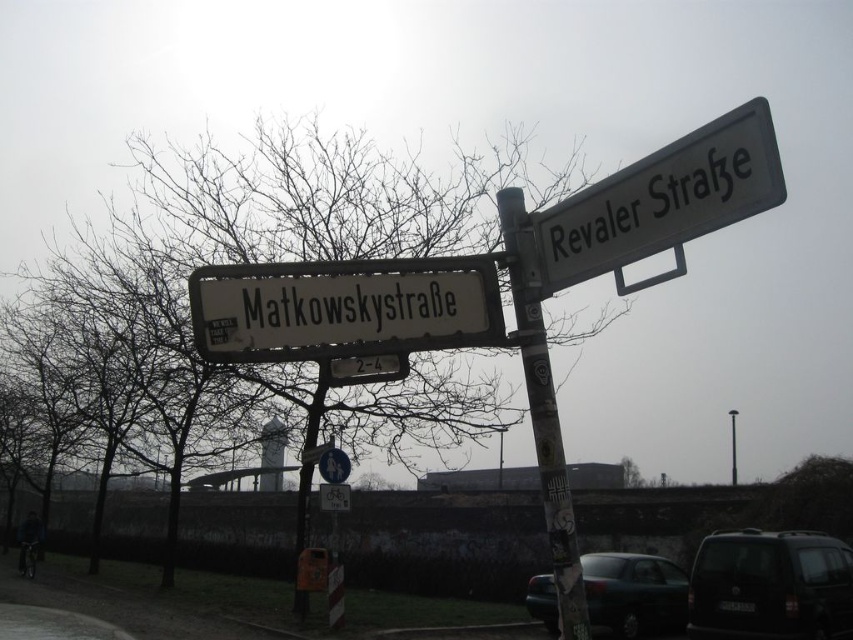
Question: Which object is farther from the camera taking this photo?

Choices:
 (A) white plastic street sign at upper right
 (B) stained wood pole at upper center
 (C) white plastic street sign at upper center
 (D) metallic pole at center

Answer: (D)

Question: Which point is farther from the camera taking this photo?

Choices:
 (A) (245, 289)
 (B) (770, 561)
 (C) (627, 205)
 (D) (567, 545)

Answer: (B)

Question: Which point is farther from the camera taking this photo?

Choices:
 (A) (538, 376)
 (B) (751, 616)

Answer: (B)

Question: Where is white plastic street sign at upper center located in relation to dark green matte car at lower right in the image?

Choices:
 (A) left
 (B) right

Answer: (A)

Question: Is stained wood pole at upper center to the right of metallic pole at upper center from the viewer's perspective?

Choices:
 (A) no
 (B) yes

Answer: (A)

Question: Can you confirm if dark green matte car at lower right is positioned to the left of metallic pole at center?

Choices:
 (A) no
 (B) yes

Answer: (A)